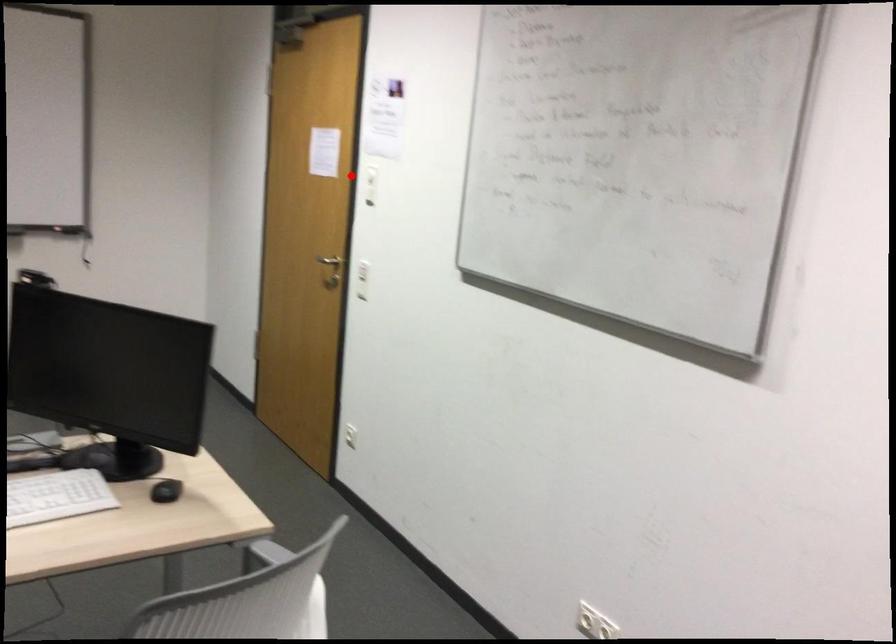
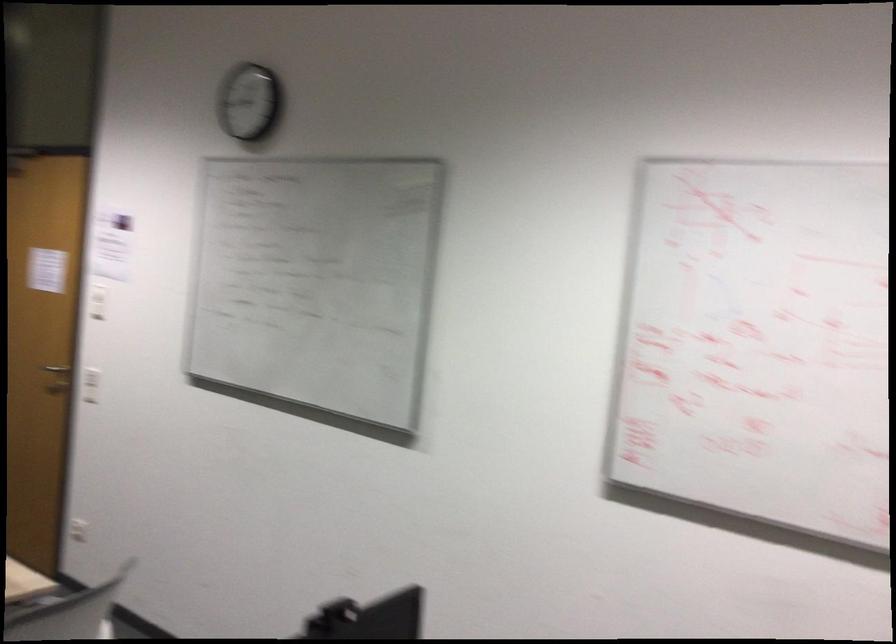
Question: I am providing you with two images of the same scene from different viewpoints. A red point is shown in image1. For the corresponding object point in image2, is it positioned nearer or farther from the camera?

Choices:
 (A) Nearer
 (B) Farther

Answer: (B)